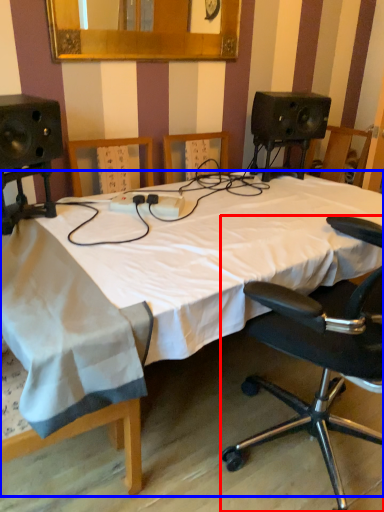
Question: Which point is closer to the camera, chair (highlighted by a red box) or bed (highlighted by a blue box)?

Choices:
 (A) chair
 (B) bed

Answer: (A)